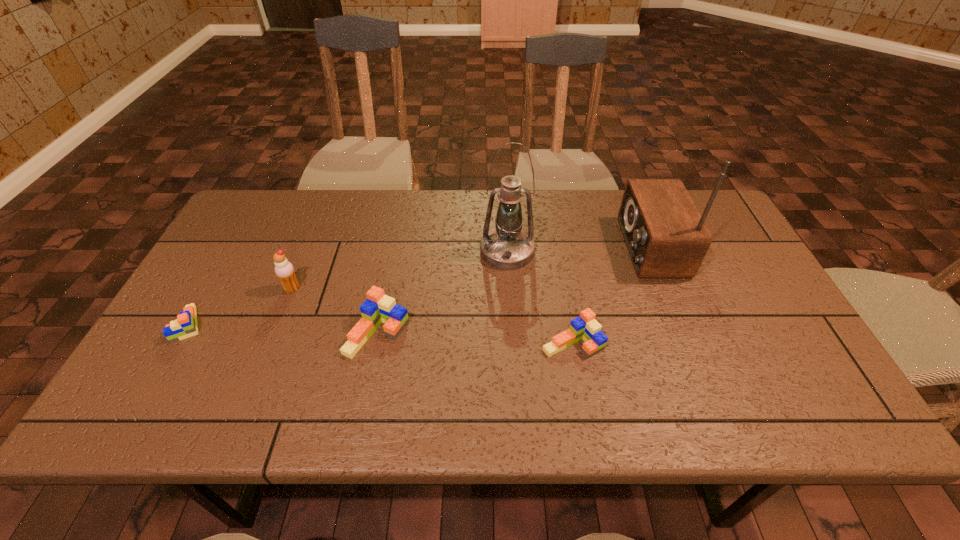
The image size is (960, 540). I want to click on the leftmost object, so click(185, 325).

At what (x,y) coordinates should I click in order to perform the action: click on the shortest object. Please return your answer as a coordinate pair (x, y). The width and height of the screenshot is (960, 540). Looking at the image, I should click on (185, 325).

What are the coordinates of `the tallest Lego` in the screenshot? It's located at (378, 308).

This screenshot has height=540, width=960. Identify the location of the third object from left to right. (378, 308).

Find the location of a particular element. the fifth tallest object is located at coordinates (585, 327).

Identify the location of the second shortest Lego. This screenshot has height=540, width=960. (585, 327).

This screenshot has height=540, width=960. Find the location of `radio receiver`. radio receiver is located at coordinates (666, 236).

This screenshot has height=540, width=960. What are the coordinates of `oil lamp` in the screenshot? It's located at (507, 246).

Locate an element on the screen. the third tallest object is located at coordinates (284, 270).

Image resolution: width=960 pixels, height=540 pixels. Identify the location of icecream. (284, 270).